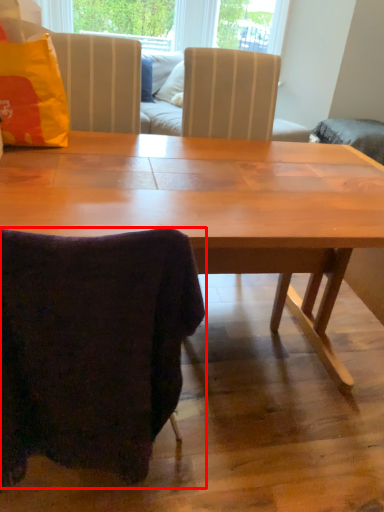
Question: Observing the image, what is the correct spatial positioning of chair (annotated by the red box) in reference to pillow?

Choices:
 (A) left
 (B) right

Answer: (B)